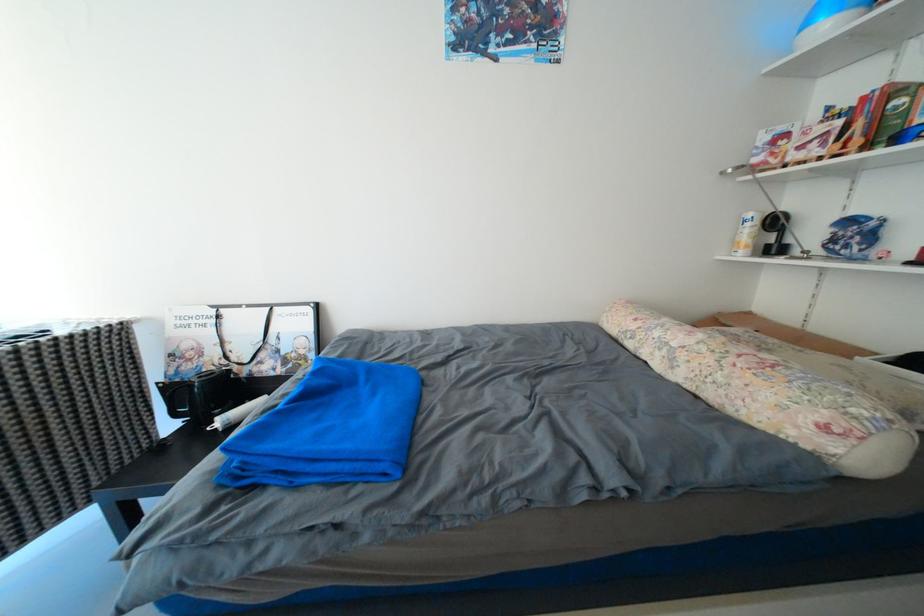
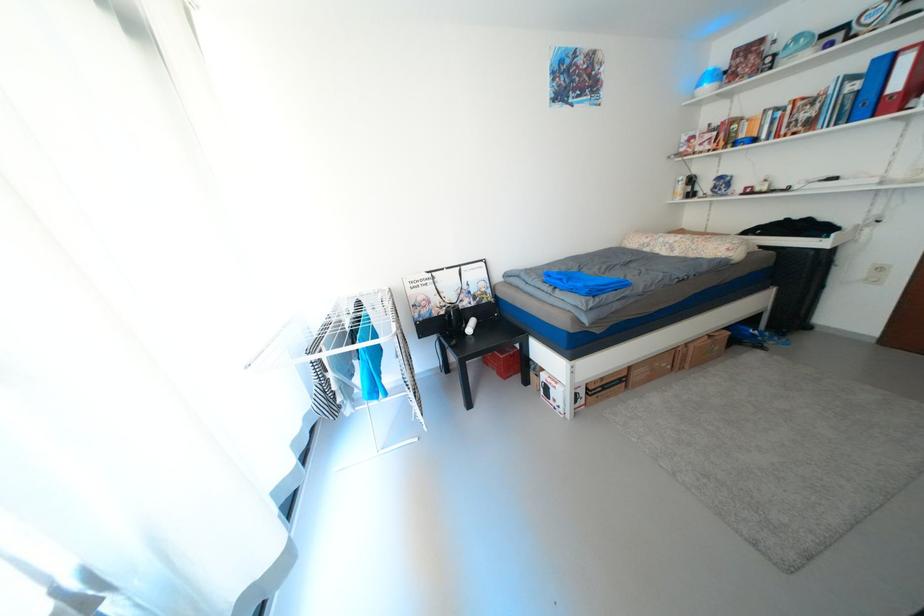
Which direction would the cameraman need to move to produce the second image?

The cameraman moved toward left, backward.